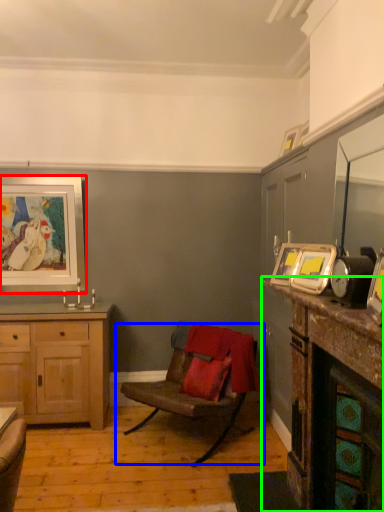
Question: Based on their relative distances, which object is farther from picture frame (highlighted by a red box)? Choose from chair (highlighted by a blue box) and counter top (highlighted by a green box).

Choices:
 (A) chair
 (B) counter top

Answer: (B)